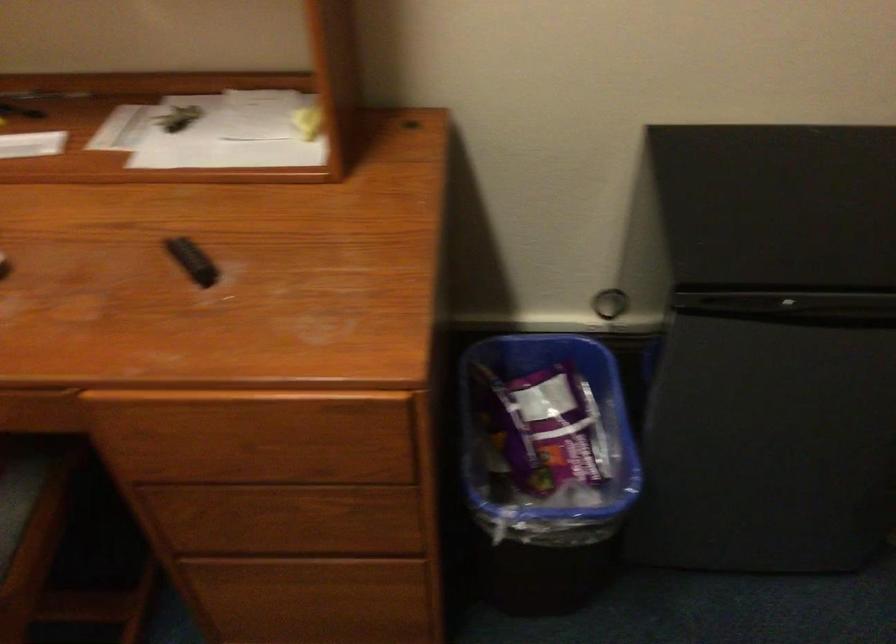
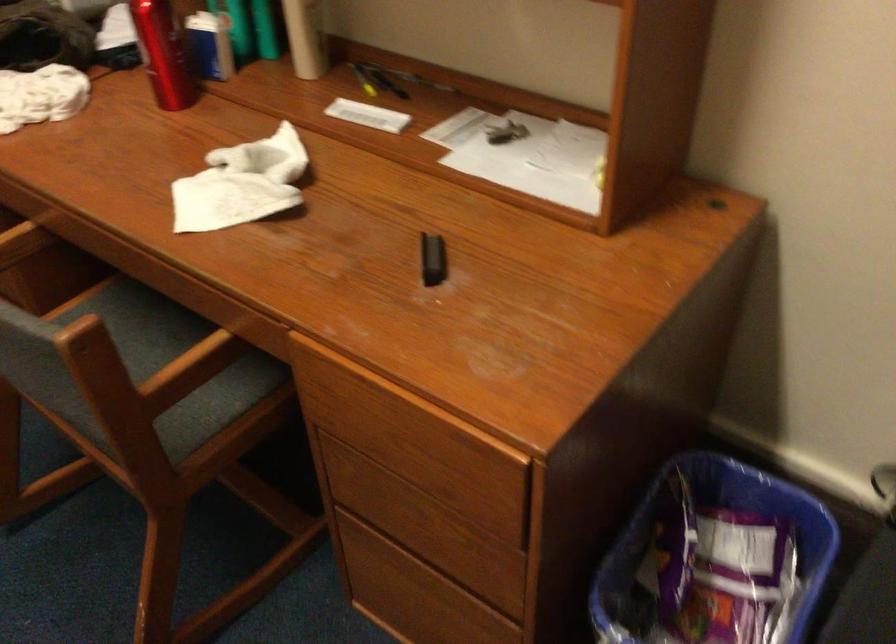
Question: Based on the continuous images, in which direction is the camera rotating? Reply with the corresponding letter.

Choices:
 (A) Left
 (B) Right
 (C) Up
 (D) Down

Answer: (A)